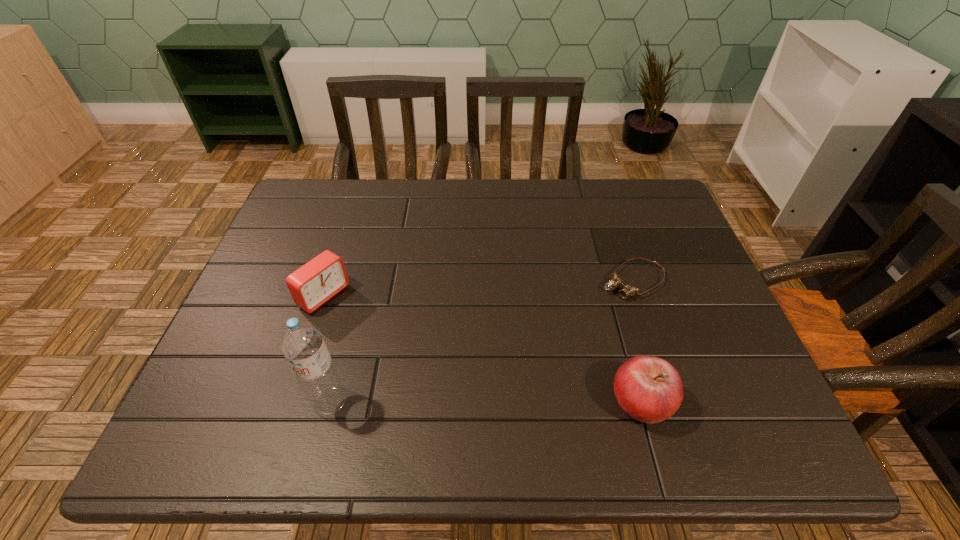
Choose which object is the third nearest neighbor to the tallest object. Please provide its 2D coordinates. Your answer should be formatted as a tuple, i.e. [(x, y)], where the tuple contains the x and y coordinates of a point satisfying the conditions above.

[(628, 290)]

Select which object is the second closest to the second shortest object. Please provide its 2D coordinates. Your answer should be formatted as a tuple, i.e. [(x, y)], where the tuple contains the x and y coordinates of a point satisfying the conditions above.

[(649, 389)]

Locate an element on the screen. The width and height of the screenshot is (960, 540). vacant space that satisfies the following two spatial constraints: 1. on the back side of the apple; 2. on the left side of the shortest object is located at coordinates 609,281.

This screenshot has width=960, height=540. What are the coordinates of `vacant area that satisfies the following two spatial constraints: 1. on the back side of the apple; 2. on the left side of the shortest object` in the screenshot? It's located at (609, 281).